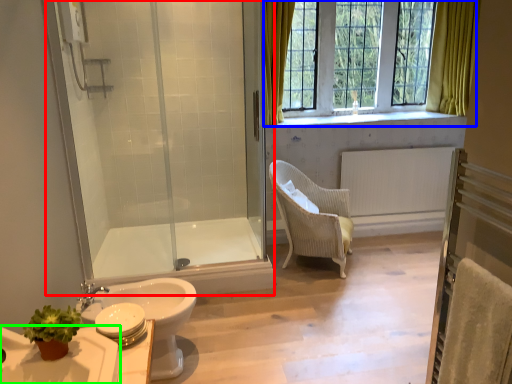
Question: Estimate the real-world distances between objects in this image. Which object is closer to shower door (highlighted by a red box), window (highlighted by a blue box) or sink (highlighted by a green box)?

Choices:
 (A) window
 (B) sink

Answer: (B)